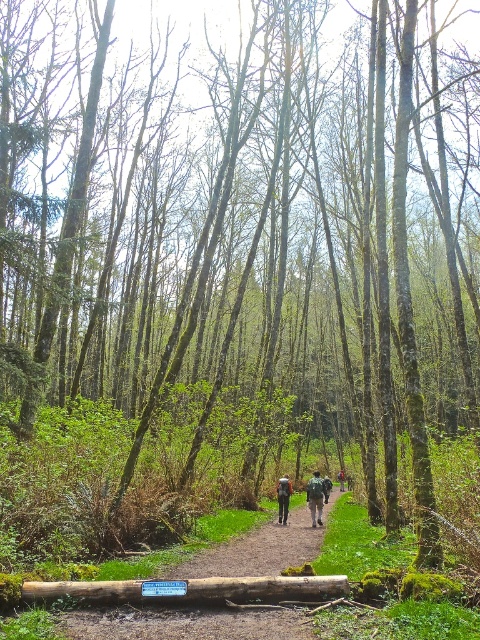
Who is higher up, brown rough log at lower center or matte gray backpacks at center?

Positioned higher is brown rough log at lower center.

Which is behind, point (137, 600) or point (325, 481)?

Positioned behind is point (325, 481).

This screenshot has height=640, width=480. Find the location of `brown rough log at lower center`. brown rough log at lower center is located at coordinates (194, 589).

Between point (308, 484) and point (343, 486), which one is positioned in front?

Point (308, 484) is in front.

Is point (313, 522) less distant than point (342, 481)?

Yes, point (313, 522) is in front of point (342, 481).

This screenshot has height=640, width=480. Find the location of `matte gray backpacks at center`. matte gray backpacks at center is located at coordinates (316, 496).

Can you confirm if orange fabric backpack at center is bigger than green fabric backpack at center?

Yes, orange fabric backpack at center is bigger than green fabric backpack at center.

Between point (283, 492) and point (339, 481), which one is positioned behind?

The point (339, 481) is more distant.

The width and height of the screenshot is (480, 640). In order to click on orange fabric backpack at center in this screenshot , I will do (284, 497).